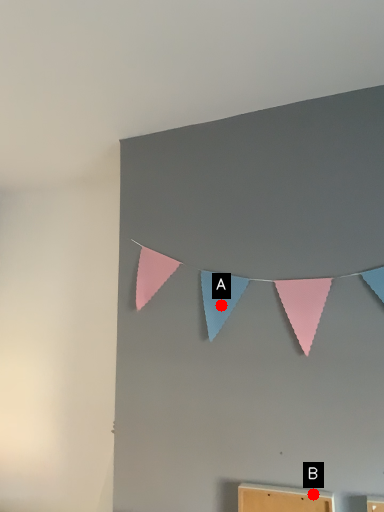
Question: Two points are circled on the image, labeled by A and B beside each circle. Which point is closer to the camera?

Choices:
 (A) A is closer
 (B) B is closer

Answer: (B)